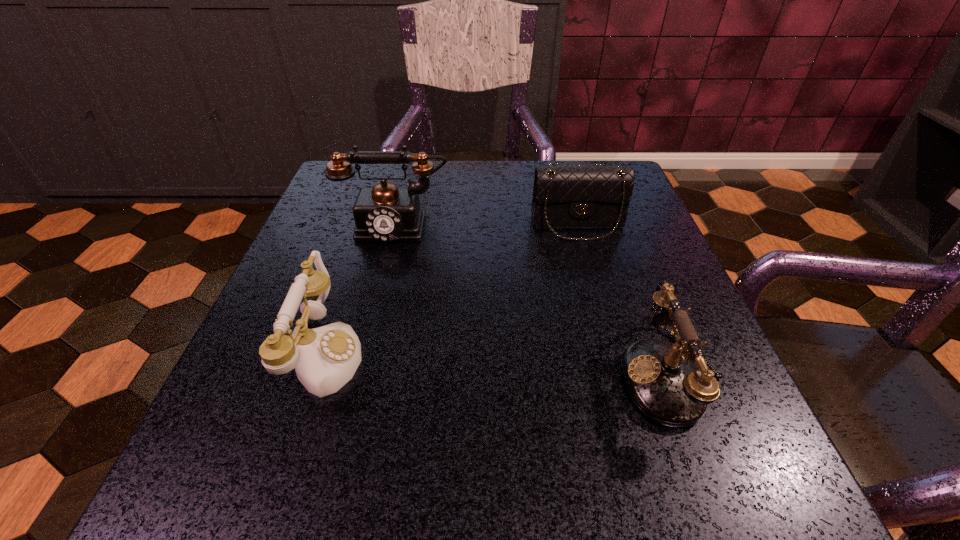
Identify the location of the tallest telephone. The width and height of the screenshot is (960, 540). (384, 213).

The height and width of the screenshot is (540, 960). Identify the location of the farthest telephone. (384, 213).

The image size is (960, 540). In order to click on the rightmost telephone in this screenshot , I will do `click(664, 383)`.

At what (x,y) coordinates should I click in order to perform the action: click on clutch bag. Please return your answer as a coordinate pair (x, y). Looking at the image, I should click on (569, 195).

Identify the location of vacant space situated 0.150m on the front of the farthest telephone at the rotary dial. (377, 299).

You are a GUI agent. You are given a task and a screenshot of the screen. Output one action in this format:
    pyautogui.click(x=<x>, y=<y>)
    Task: Click on the vacant space situated on the dial of the rightmost telephone
    This screenshot has height=540, width=960.
    Given the screenshot: What is the action you would take?
    pyautogui.click(x=477, y=376)

You are a GUI agent. You are given a task and a screenshot of the screen. Output one action in this format:
    pyautogui.click(x=<x>, y=<y>)
    Task: Click on the blank area located 0.060m on the dial of the rightmost telephone
    The height and width of the screenshot is (540, 960).
    Given the screenshot: What is the action you would take?
    pyautogui.click(x=581, y=376)

Locate an element on the screen. The height and width of the screenshot is (540, 960). free space located 0.070m on the dial of the rightmost telephone is located at coordinates (574, 376).

Where is `vacant space located 0.160m on the front flap of the clutch bag`? vacant space located 0.160m on the front flap of the clutch bag is located at coordinates (598, 297).

Locate an element on the screen. Image resolution: width=960 pixels, height=540 pixels. telephone located in the far edge section of the desktop is located at coordinates (384, 213).